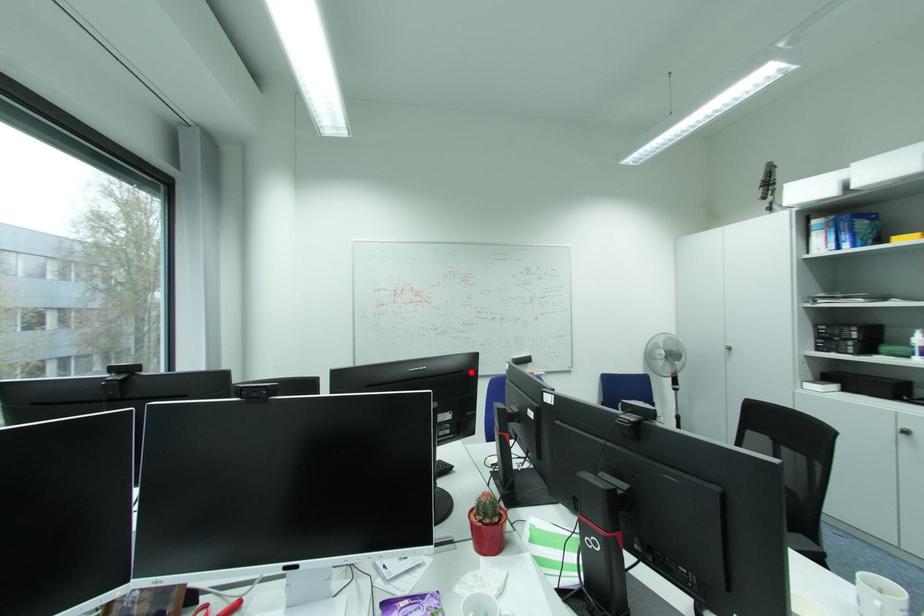
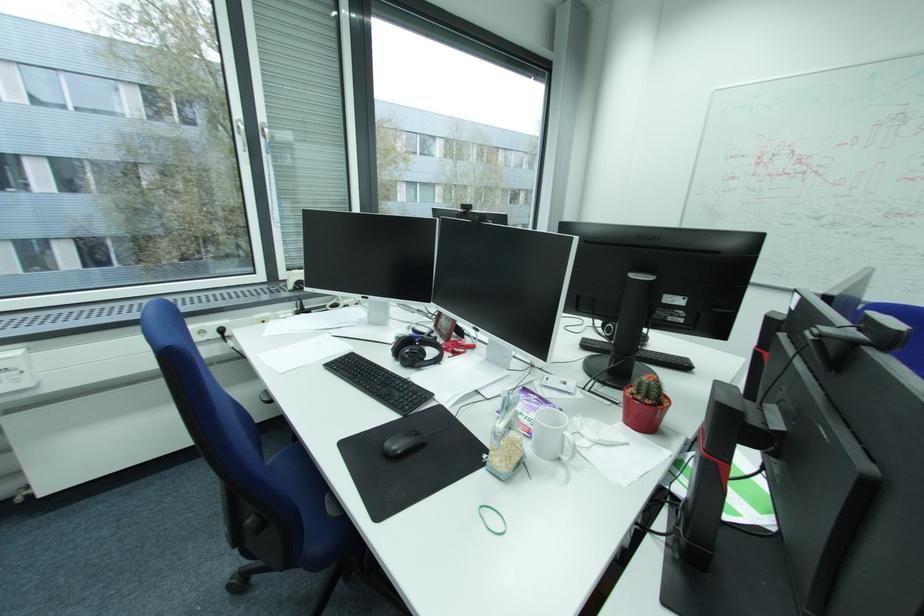
Question: I am providing you with two images of the same scene from different viewpoints. A red point is marked on the first image. Is the red point's position out of view in image 2?

Choices:
 (A) Yes
 (B) No

Answer: (B)